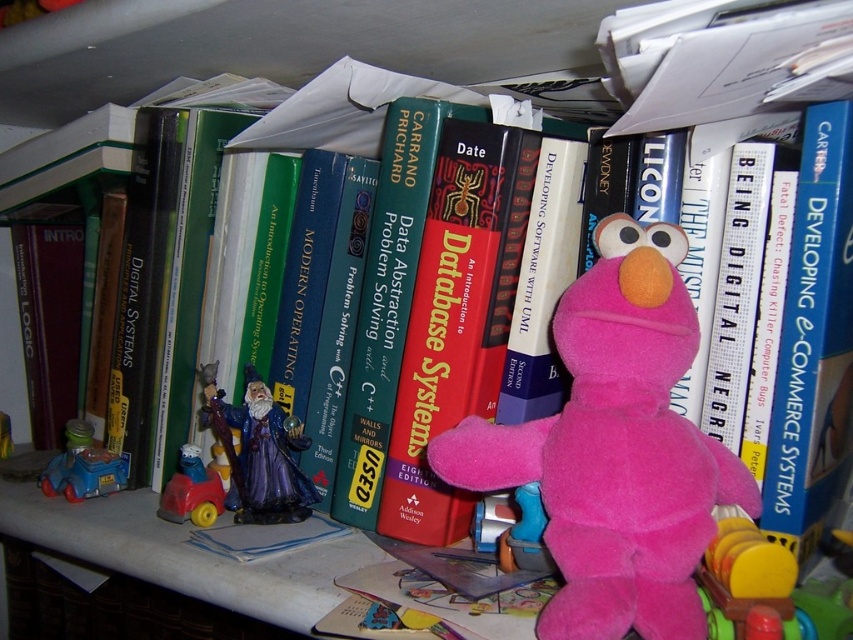
You are organizing a childrens party and need to find a shiny purple wizard figurine at center left. The bookshelf has a point marked at (258,451). Is this point where the shiny purple wizard figurine at center left is located?

Yes, the point (258,451) corresponds to the shiny purple wizard figurine at center left.